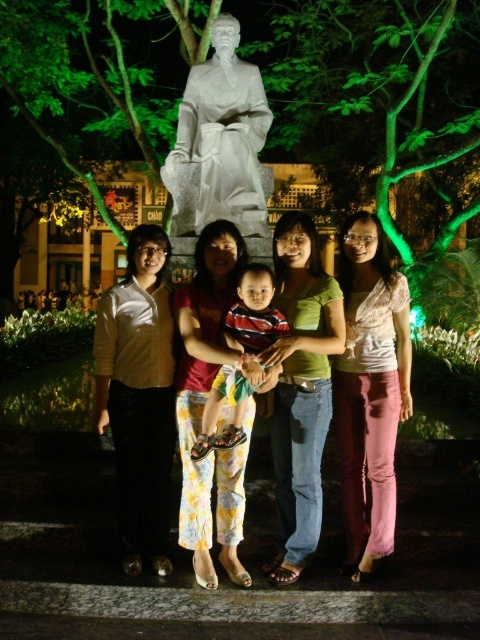
Question: From the image, what is the correct spatial relationship of satin gold blouse at center in relation to green cotton shirt at center?

Choices:
 (A) below
 (B) above

Answer: (A)

Question: Considering the real-world distances, which object is closest to the floral cotton pants at center?

Choices:
 (A) matte white statue at center
 (B) white marble statue at center

Answer: (A)

Question: Is matte white statue at center to the right of striped cotton shirt at center from the viewer's perspective?

Choices:
 (A) yes
 (B) no

Answer: (A)

Question: Which point appears closest to the camera in this image?

Choices:
 (A) (380, 438)
 (B) (230, 557)

Answer: (B)

Question: Among these points, which one is nearest to the camera?

Choices:
 (A) (372, 244)
 (B) (291, 454)
 (C) (200, 282)

Answer: (B)

Question: Is matte white statue at center smaller than white marble statue at center?

Choices:
 (A) no
 (B) yes

Answer: (B)